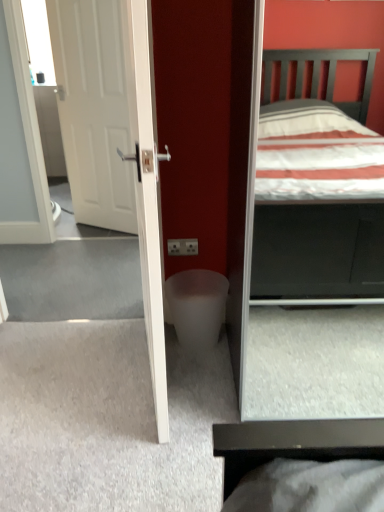
In order to face white matte door at left, should I rotate leftwards or rightwards?

A 12.896 degree turn to the left will do.

What do you see at coordinates (93, 110) in the screenshot?
I see `white matte door at left` at bounding box center [93, 110].

The height and width of the screenshot is (512, 384). I want to click on white matte door at left, so click(x=93, y=110).

Where is `white frosted glass at center`? Image resolution: width=384 pixels, height=512 pixels. white frosted glass at center is located at coordinates (197, 307).

The height and width of the screenshot is (512, 384). Describe the element at coordinates (197, 307) in the screenshot. I see `white frosted glass at center` at that location.

The width and height of the screenshot is (384, 512). Find the location of `white matte door at left`. white matte door at left is located at coordinates click(x=93, y=110).

Looking at this image, visually, is white frosted glass at center positioned to the left or to the right of white matte door at left?

Clearly, white frosted glass at center is on the right of white matte door at left in the image.

Is white frosted glass at center positioned in front of white matte door at left?

Yes, white frosted glass at center is closer to the camera.

Is point (198, 306) closer or farther from the camera than point (97, 223)?

Point (198, 306) is positioned closer to the camera compared to point (97, 223).

From the image's perspective, is white frosted glass at center above white matte door at left?

Actually, white frosted glass at center appears below white matte door at left in the image.

From a real-world perspective, is white frosted glass at center below white matte door at left?

Yes, from a real-world perspective, white frosted glass at center is under white matte door at left.

Does white frosted glass at center have a lesser width compared to white matte door at left?

No, white frosted glass at center is not thinner than white matte door at left.

Considering the sizes of objects white frosted glass at center and white matte door at left in the image provided, who is shorter, white frosted glass at center or white matte door at left?

white frosted glass at center is shorter.

Considering the sizes of objects white frosted glass at center and white matte door at left in the image provided, who is smaller, white frosted glass at center or white matte door at left?

With smaller size is white frosted glass at center.

Is white frosted glass at center positioned beyond the bounds of white matte door at left?

Yes, white frosted glass at center is located beyond the bounds of white matte door at left.

Are white frosted glass at center and white matte door at left beside each other?

No, white frosted glass at center is not with white matte door at left.

Is white frosted glass at center positioned with its back to white matte door at left?

No, white frosted glass at center is not facing the opposite direction of white matte door at left.

How different are the orientations of white frosted glass at center and white matte door at left in degrees?

white frosted glass at center and white matte door at left are facing 29.5 degrees away from each other.

In the scene shown: How much distance is there between white frosted glass at center and white matte door at left?

They are 4.79 feet apart.

Locate an element on the screen. The width and height of the screenshot is (384, 512). door located on the left of white frosted glass at center is located at coordinates (93, 110).

Which is more to the left, white matte door at left or white frosted glass at center?

Positioned to the left is white matte door at left.

Considering the positions of objects white matte door at left and white frosted glass at center in the image provided, who is behind, white matte door at left or white frosted glass at center?

white matte door at left.

Is point (109, 6) closer to viewer compared to point (179, 273)?

No, (109, 6) is behind (179, 273).

From the image's perspective, is white matte door at left below white frosted glass at center?

Actually, white matte door at left appears above white frosted glass at center in the image.

From a real-world perspective, is white matte door at left located higher than white frosted glass at center?

Indeed, from a real-world perspective, white matte door at left stands above white frosted glass at center.

In the scene shown: Between white matte door at left and white frosted glass at center, which one has larger width?

white frosted glass at center.

Does white matte door at left have a greater height compared to white frosted glass at center?

Indeed, white matte door at left has a greater height compared to white frosted glass at center.

From the picture: Considering the sizes of objects white matte door at left and white frosted glass at center in the image provided, who is bigger, white matte door at left or white frosted glass at center?

white matte door at left is bigger.

Is white matte door at left not within white frosted glass at center?

Absolutely, white matte door at left is external to white frosted glass at center.

Is white matte door at left placed right next to white frosted glass at center?

white matte door at left and white frosted glass at center are not in contact.

Is white matte door at left looking in the opposite direction of white frosted glass at center?

That's not correct — white matte door at left is not looking away from white frosted glass at center.

How many degrees apart are the facing directions of white matte door at left and white frosted glass at center?

29.5 degrees.

This screenshot has height=512, width=384. Identify the location of door above the white frosted glass at center (from the image's perspective). (93, 110).

Image resolution: width=384 pixels, height=512 pixels. In order to click on toilet bowl that appears below the white matte door at left (from a real-world perspective) in this screenshot , I will do `click(197, 307)`.

Locate an element on the screen. The height and width of the screenshot is (512, 384). door located above the white frosted glass at center (from the image's perspective) is located at coordinates (93, 110).